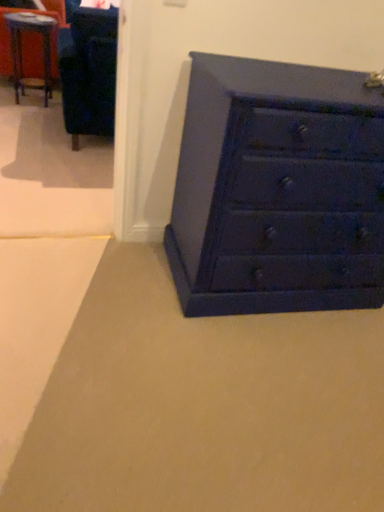
Question: Can you confirm if metallic blue table at upper left is shorter than velvet blue armchair at upper left?

Choices:
 (A) yes
 (B) no

Answer: (A)

Question: Can you confirm if metallic blue table at upper left is positioned to the right of velvet blue armchair at upper left?

Choices:
 (A) yes
 (B) no

Answer: (B)

Question: Considering the relative sizes of metallic blue table at upper left and velvet blue armchair at upper left in the image provided, is metallic blue table at upper left taller than velvet blue armchair at upper left?

Choices:
 (A) no
 (B) yes

Answer: (A)

Question: From a real-world perspective, is metallic blue table at upper left beneath velvet blue armchair at upper left?

Choices:
 (A) yes
 (B) no

Answer: (A)

Question: Is metallic blue table at upper left next to velvet blue armchair at upper left and touching it?

Choices:
 (A) no
 (B) yes

Answer: (A)

Question: Considering the positions of matte blue chest of drawers at lower right and metallic blue table at upper left in the image, is matte blue chest of drawers at lower right wider or thinner than metallic blue table at upper left?

Choices:
 (A) thin
 (B) wide

Answer: (B)

Question: Is matte blue chest of drawers at lower right in front of or behind metallic blue table at upper left in the image?

Choices:
 (A) behind
 (B) front

Answer: (B)

Question: Considering the positions of point (x=359, y=128) and point (x=34, y=77), is point (x=359, y=128) closer or farther from the camera than point (x=34, y=77)?

Choices:
 (A) closer
 (B) farther

Answer: (A)

Question: In terms of height, does matte blue chest of drawers at lower right look taller or shorter compared to metallic blue table at upper left?

Choices:
 (A) short
 (B) tall

Answer: (B)

Question: Considering the relative positions of matte blue chest of drawers at lower right and velvet blue armchair at upper left in the image provided, is matte blue chest of drawers at lower right to the left or to the right of velvet blue armchair at upper left?

Choices:
 (A) right
 (B) left

Answer: (A)

Question: In terms of width, does matte blue chest of drawers at lower right look wider or thinner when compared to velvet blue armchair at upper left?

Choices:
 (A) thin
 (B) wide

Answer: (A)

Question: Is point click(283, 143) positioned closer to the camera than point click(109, 90)?

Choices:
 (A) farther
 (B) closer

Answer: (B)

Question: From the image's perspective, relative to velvet blue armchair at upper left, is matte blue chest of drawers at lower right above or below?

Choices:
 (A) above
 (B) below

Answer: (B)

Question: Considering the positions of metallic blue table at upper left and velvet blue armchair at upper left in the image, is metallic blue table at upper left taller or shorter than velvet blue armchair at upper left?

Choices:
 (A) short
 (B) tall

Answer: (A)

Question: Would you say metallic blue table at upper left is to the left or to the right of velvet blue armchair at upper left in the picture?

Choices:
 (A) right
 (B) left

Answer: (B)